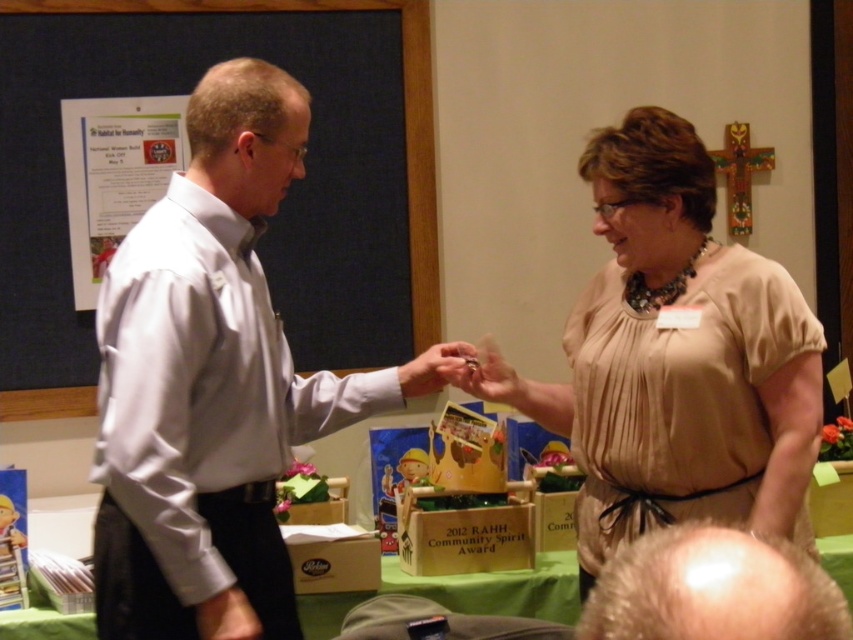
This screenshot has width=853, height=640. Describe the element at coordinates (680, 356) in the screenshot. I see `beige satin blouse at center` at that location.

Who is more distant from viewer, (624, 417) or (514, 401)?

The point (514, 401) is behind.

I want to click on beige satin blouse at center, so click(680, 356).

The image size is (853, 640). I want to click on beige satin blouse at center, so click(x=680, y=356).

Which is below, blue fabric bulletin board at upper left or metallic ring at center?

metallic ring at center

Which is in front, point (426, 298) or point (505, 400)?

Point (505, 400) is in front.

Where is `blue fabric bulletin board at upper left`? Image resolution: width=853 pixels, height=640 pixels. blue fabric bulletin board at upper left is located at coordinates (404, 116).

How distant is beige satin blouse at center from blue fabric bulletin board at upper left?

A distance of 4.18 feet exists between beige satin blouse at center and blue fabric bulletin board at upper left.

Does point (770, 481) come in front of point (73, 404)?

Yes, it is in front of point (73, 404).

Measure the distance between point (761, 435) and camera.

The distance of point (761, 435) from camera is 1.64 meters.

At what (x,y) coordinates should I click in order to perform the action: click on beige satin blouse at center. Please return your answer as a coordinate pair (x, y). The height and width of the screenshot is (640, 853). Looking at the image, I should click on (680, 356).